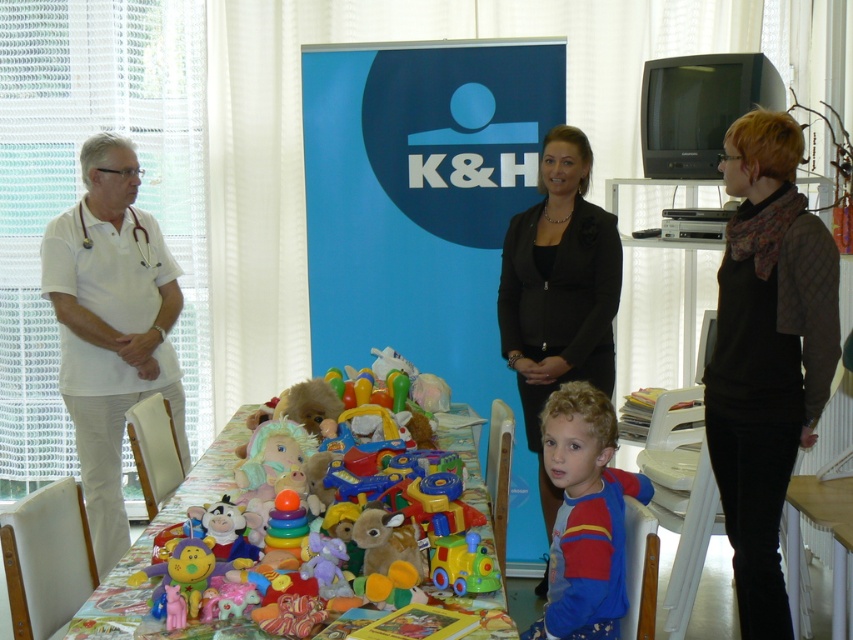
You are organizing a charity event and need to decide which shirt to use for volunteers. The white matte shirt at left and the blue cotton shirt at lower center are available. Which shirt has a greater width?

The white matte shirt at left has a greater width than the blue cotton shirt at lower center.

You are a volunteer at a charity event and need to determine if a small box can fit between the white matte shirt at left and the black smooth blazer at center. The box is 10 cm tall. Can it fit vertically?

The white matte shirt at left is much taller than the black smooth blazer at center. Since the box is only 10 cm tall, it can fit vertically between them as the height difference allows space.

You are organizing a charity event and need to place a new donation box between the white matte shirt at left and the blue cotton shirt at lower center. Based on their positions, where should you place the donation box?

The donation box should be placed to the right of the white matte shirt at left and to the left of the blue cotton shirt at lower center since the white matte shirt at left is positioned to the left of the blue cotton shirt at lower center.